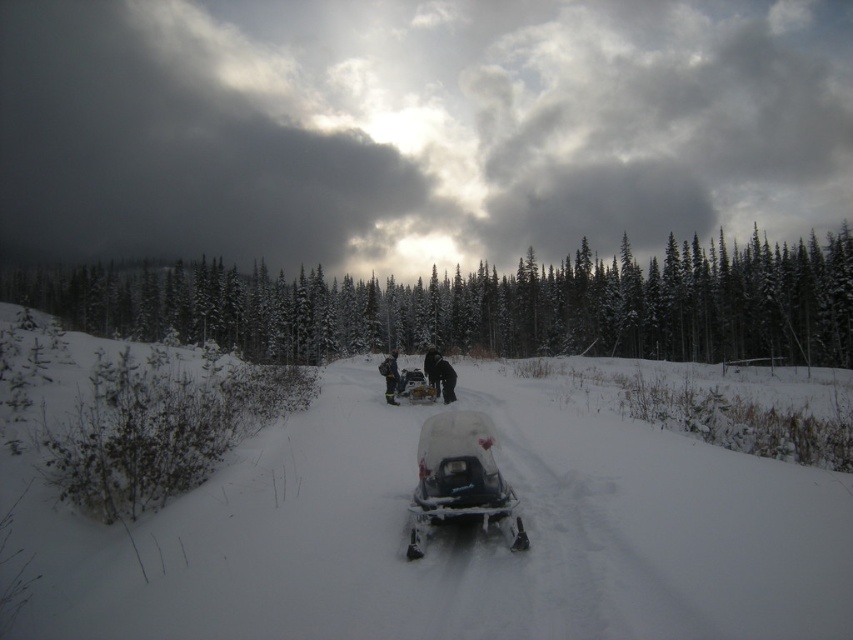
You are standing at the snowmobile and looking towards the forest. Which of the two points, point (453, 371) or point (439, 355), would appear closer to you in the scene?

Point (453, 371) is closer to the camera than point (439, 355), so it would appear closer to you.

You are standing at the point marked by the coordinates point (444, 378) in the snowy landscape. What object is located exactly at this point?

The point (444, 378) corresponds to the black fabric jacket at center.

You are standing at the snowmobile with a transparent cover on the path in a snowy landscape. You want to walk directly towards the dense forest of evergreen trees ahead. The point marked at coordinate (457, 536) shows white powdery snow at center. Will you encounter any obstacles on your path before reaching the forest?

The point marked at coordinate (457, 536) indicates white powdery snow at center, which suggests that the path towards the dense forest of evergreen trees is clear of obstacles since the snow is undisturbed and powdery.